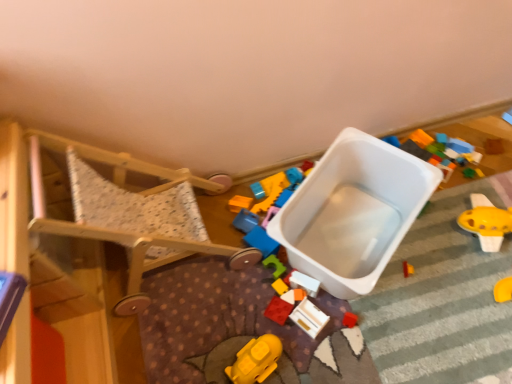
This screenshot has height=384, width=512. In order to click on empty space that is in between yellow matte toy at lower center, placed as the 6th toy when sorted from right to left, and wooden toy at center, which appears as the fifth toy when viewed from the left in this screenshot , I will do `click(287, 336)`.